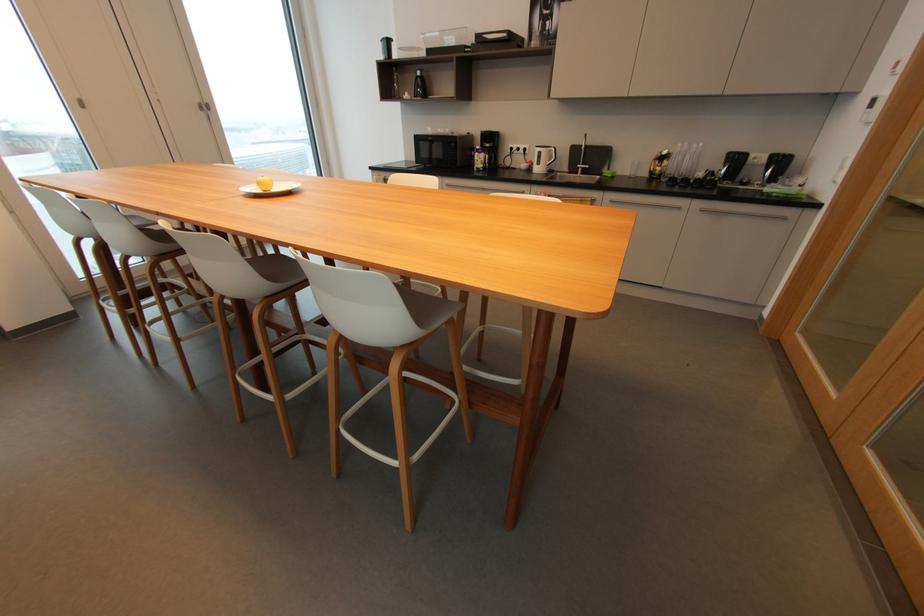
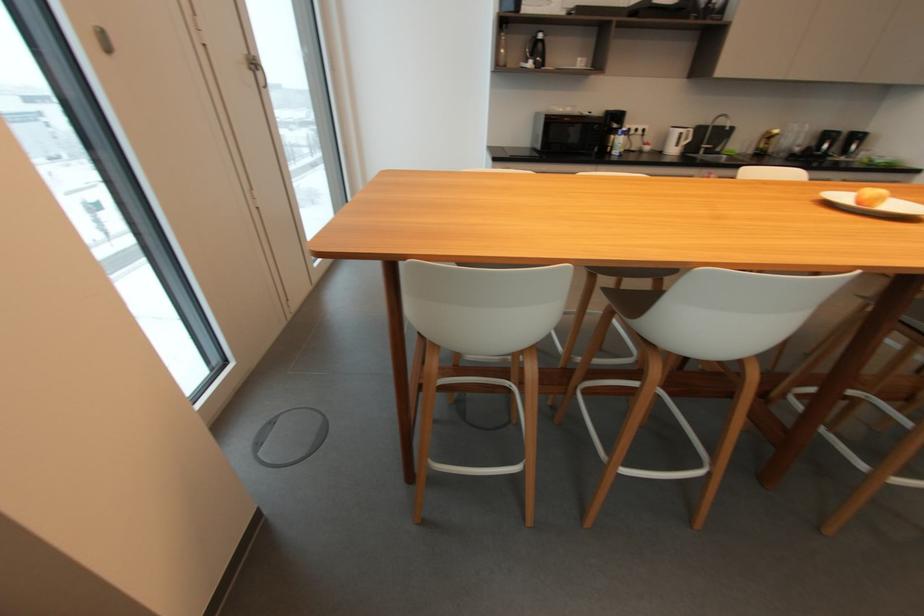
Where in the second image is the point corresponding to [421,74] from the first image?

(544, 36)